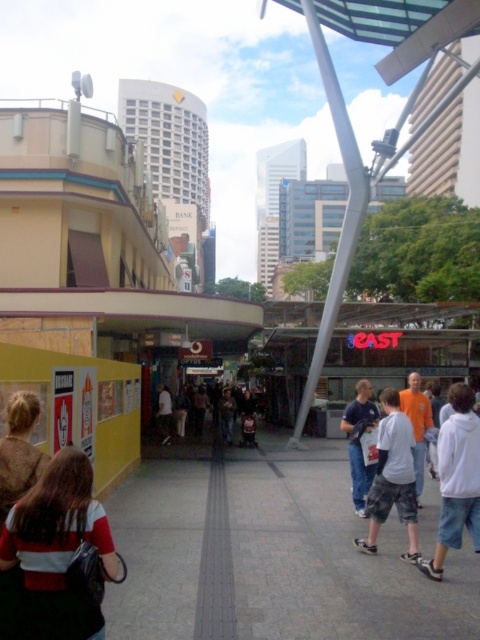
Can you confirm if gray concrete pavement at center is wider than dark gray pants at center?

Yes, gray concrete pavement at center is wider than dark gray pants at center.

Can you confirm if gray concrete pavement at center is smaller than dark gray pants at center?

No.

Does point (431, 621) come in front of point (157, 388)?

That is True.

This screenshot has width=480, height=640. I want to click on gray concrete pavement at center, so click(271, 556).

Can you confirm if white cotton hoodie at lower right is taller than brown textured sweater at lower left?

Correct, white cotton hoodie at lower right is much taller as brown textured sweater at lower left.

Can you confirm if white cotton hoodie at lower right is positioned to the left of brown textured sweater at lower left?

In fact, white cotton hoodie at lower right is to the right of brown textured sweater at lower left.

Which is in front, point (452, 428) or point (36, 406)?

Point (36, 406) is more forward.

This screenshot has height=640, width=480. I want to click on white cotton hoodie at lower right, so click(x=456, y=477).

Is the position of dark gray fabric jacket at center less distant than that of dark brown leather jacket at center?

Yes, it is.

Is point (253, 435) in front of point (228, 426)?

Yes, point (253, 435) is in front of point (228, 426).

Who is more forward, (197, 419) or (224, 396)?

Positioned in front is point (224, 396).

The image size is (480, 640). Identify the location of dark gray fabric jacket at center. (216, 410).